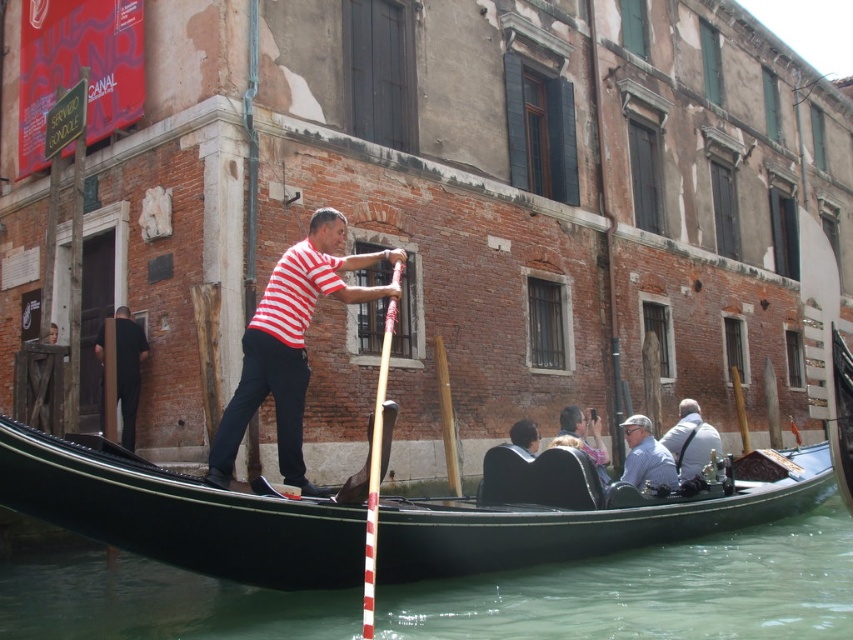
You are standing on the gondola and want to reach both the point at coordinates point (258, 620) and point (671, 428). Which point should you move towards first to reach the closer one?

Point (258, 620) is closer to the viewer than point (671, 428), so you should move towards point (258, 620) first.

You are a tourist standing on the bridge looking down at the black polished wood gondola at center and the black glossy water at lower center. Which object is taller from your perspective?

The black polished wood gondola at center is much taller than the black glossy water at lower center from your perspective.